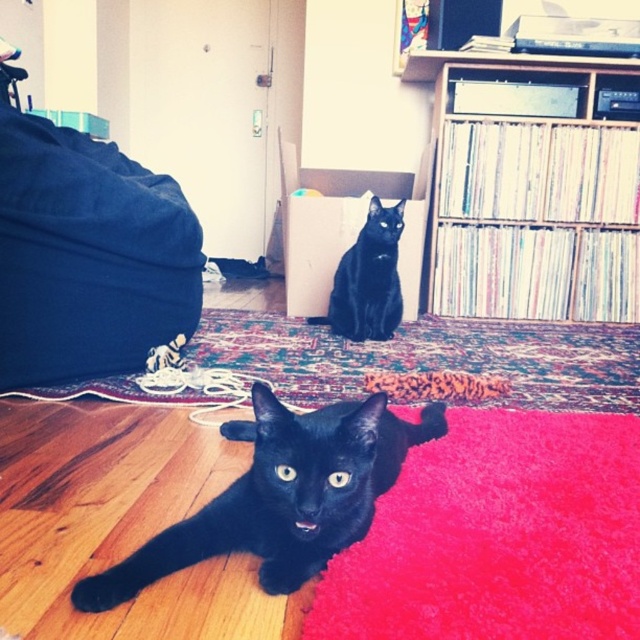
You are a cat owner who wants to ensure your two cats can comfortably interact without overcrowding. Given that cats typically need at least 24 inches of space between them to feel comfortable, can the cats at point (296, 472) maintain this distance?

The cats at point (296, 472) are 35.10 inches apart, which exceeds the recommended 24 inches, so they can comfortably interact without overcrowding.

You are a cat owner who wants to place a new cat tree in the room. The shiny black cat at lower left and the black matte cat at upper center both need access to it. Based on their positions, where should you place the cat tree so both cats can reach it easily?

The shiny black cat at lower left is positioned under the black matte cat at upper center, so placing the cat tree in a central area between their positions would ensure both cats can reach it easily.

You are a cat owner who wants to place a new toy for your cat. The toy requires a space that is at least 2 meters away from the blue fabric bag at left. Is the current setup sufficient?

The blue fabric bag at left is 1.54 meters away from camera, so the current setup is insufficient because the required distance is 2 meters.